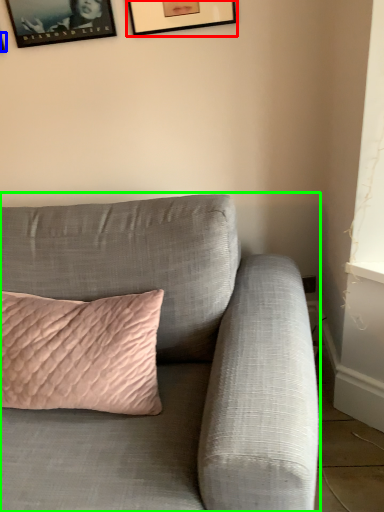
Question: Which is farther away from picture frame (highlighted by a red box)? picture frame (highlighted by a blue box) or studio couch (highlighted by a green box)?

Choices:
 (A) picture frame
 (B) studio couch

Answer: (B)